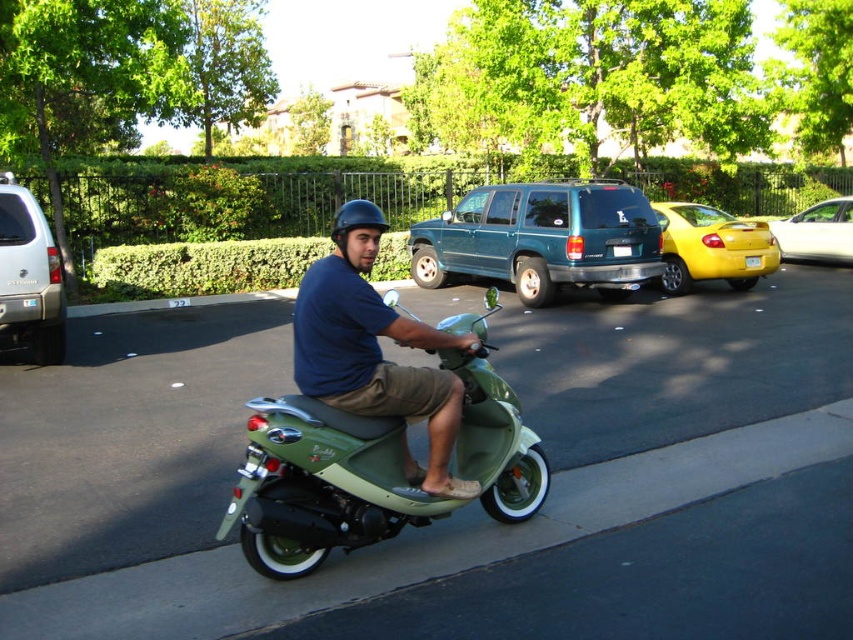
From the picture: You are standing in the parking lot and want to place a small potted plant between the two points marked as point (x=355, y=298) and point (x=619, y=256). Based on their positions, which point should the plant be closer to in order to be nearer to the viewer?

The plant should be placed closer to point (x=355, y=298) because it is closer to the viewer than point (x=619, y=256).

You are standing at the point marked by the coordinates point (374, 349). What object is exactly at that location?

The matte green scooter at center is located at point (374, 349).

You are standing at point (12, 180) and want to walk to the parked teal SUV in the middle. Is the point (329, 509) between you and the teal SUV?

Yes, point (329, 509) is between you and the teal SUV in the middle because it is in front of point (12, 180) where you are standing.